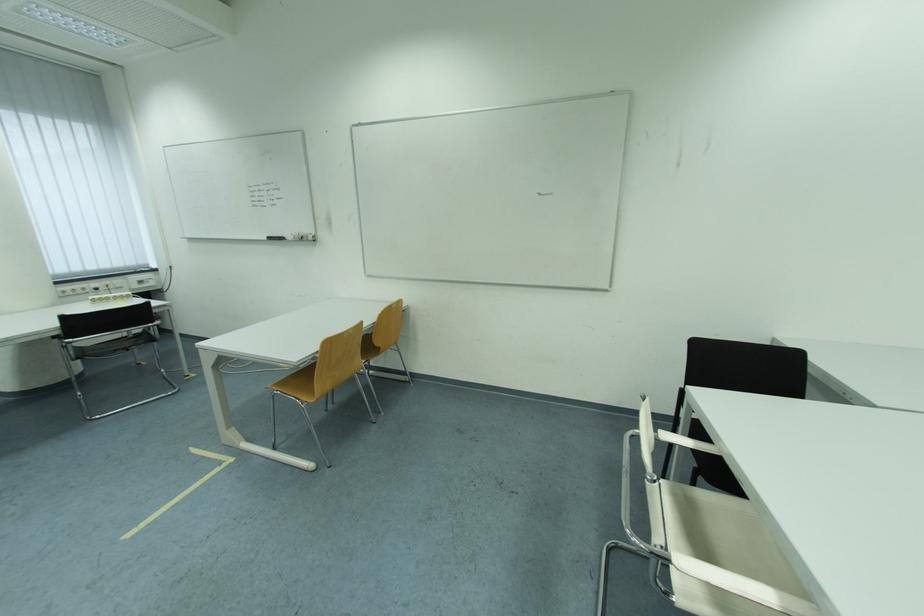
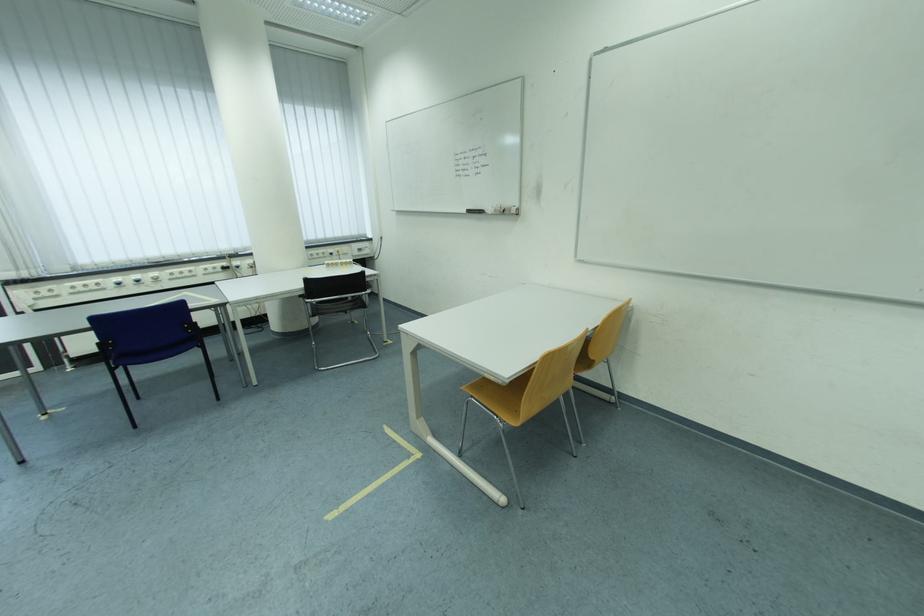
Question: The camera is either moving clockwise (left) or counter-clockwise (right) around the object. The first image is from the beginning of the video and the second image is from the end. Is the camera moving left or right when shooting the video?

Choices:
 (A) Left
 (B) Right

Answer: (B)